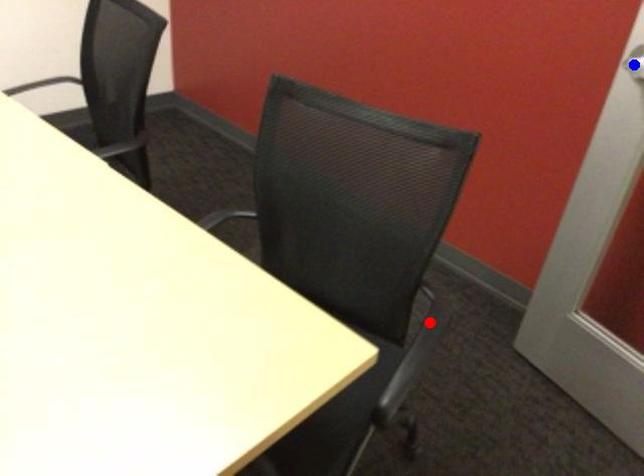
Question: In the image, two points are highlighted. Which point is nearer to the camera? Reply with the corresponding letter.

Choices:
 (A) blue point
 (B) red point

Answer: (B)